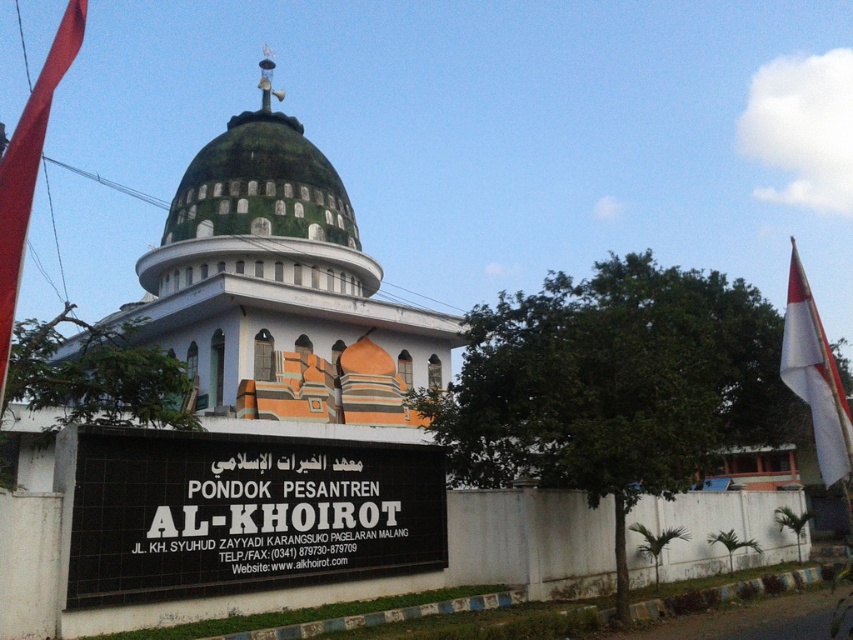
Question: Which point is farther from the camera taking this photo?

Choices:
 (A) (30, 134)
 (B) (178, 204)
 (C) (830, 465)
 (D) (90, 522)

Answer: (B)

Question: Does green matte dome at center have a lesser width compared to white fabric flag at right?

Choices:
 (A) no
 (B) yes

Answer: (B)

Question: Which object appears farthest from the camera in this image?

Choices:
 (A) red fabric flag at left
 (B) white fabric flag at right
 (C) black plastic sign at center

Answer: (B)

Question: Estimate the real-world distances between objects in this image. Which object is farther from the red fabric flag at left?

Choices:
 (A) white fabric flag at right
 (B) black plastic sign at center

Answer: (A)

Question: Does green matte dome at center appear under red fabric flag at left?

Choices:
 (A) yes
 (B) no

Answer: (A)

Question: Where is black plastic sign at center located in relation to green matte dome at center in the image?

Choices:
 (A) right
 (B) left

Answer: (A)